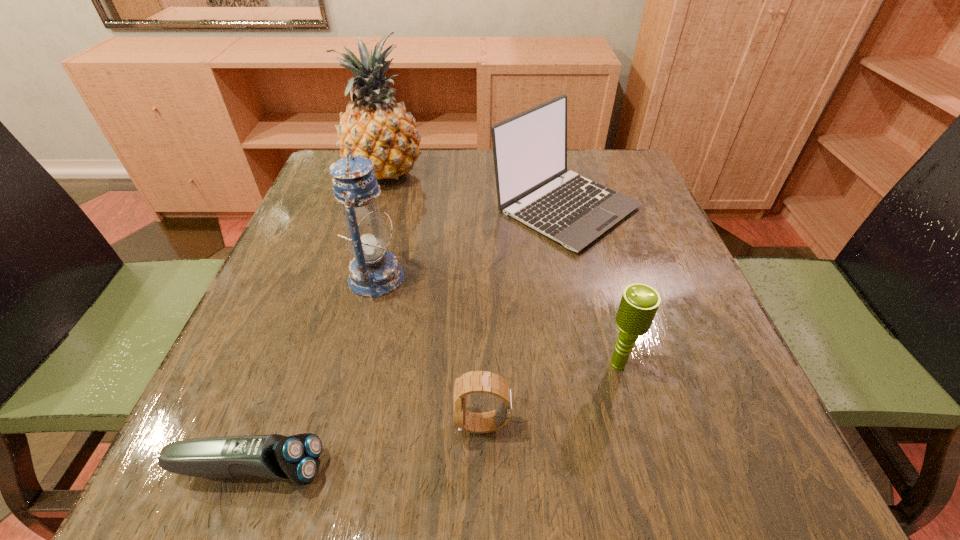
I want to click on free location located on the front-facing side of the lantern, so click(x=450, y=277).

Where is `vacant region located 0.150m at the front screen of the laptop_computer`? Image resolution: width=960 pixels, height=540 pixels. vacant region located 0.150m at the front screen of the laptop_computer is located at coordinates (589, 312).

You are a GUI agent. You are given a task and a screenshot of the screen. Output one action in this format:
    pyautogui.click(x=<x>, y=<y>)
    Task: Click on the vacant space located on the front of the fourth farthest object
    The width and height of the screenshot is (960, 540).
    Given the screenshot: What is the action you would take?
    pyautogui.click(x=655, y=499)

Identify the location of vacant space located 0.320m on the face of the second shortest object. This screenshot has height=540, width=960. (233, 424).

What are the coordinates of `free region located on the face of the second shortest object` in the screenshot? It's located at (254, 424).

Locate an element on the screen. free space located 0.190m on the face of the second shortest object is located at coordinates (324, 424).

The height and width of the screenshot is (540, 960). In order to click on free space located 0.190m on the head of the nearest object in this screenshot , I will do `click(467, 469)`.

Find the location of a particular element. This screenshot has height=540, width=960. pineapple that is at the far edge is located at coordinates (376, 127).

This screenshot has width=960, height=540. Identify the location of laptop_computer at the far edge. (533, 186).

This screenshot has width=960, height=540. Identify the location of watch located in the near edge section of the desktop. (478, 381).